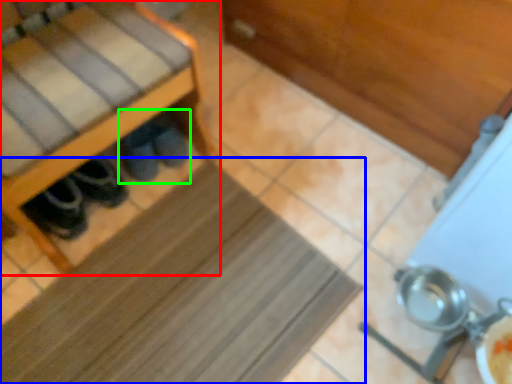
Question: Which is farther away from furniture (highlighted by a red box)? mat (highlighted by a blue box) or footwear (highlighted by a green box)?

Choices:
 (A) mat
 (B) footwear

Answer: (A)